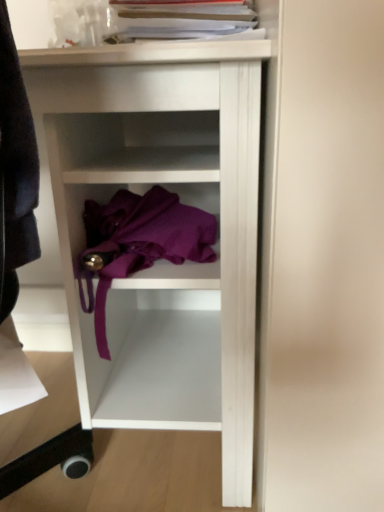
What do you see at coordinates (162, 260) in the screenshot?
I see `white matte shelf at center` at bounding box center [162, 260].

Image resolution: width=384 pixels, height=512 pixels. What are the coordinates of `white matte shelf at center` in the screenshot? It's located at (162, 260).

Where is `white matte shelf at center`? This screenshot has width=384, height=512. white matte shelf at center is located at coordinates (162, 260).